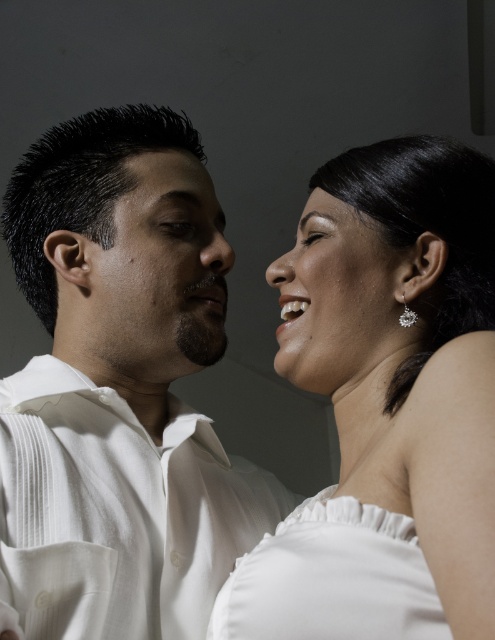
You are a photographer adjusting the lighting for a portrait. You notice the smooth skin face at center and the satin white earring at upper right. Which object should you focus your light on to highlight the face without overwhelming the earring?

The smooth skin face at center is above the satin white earring at upper right, so focusing the light on the smooth skin face at center will highlight it without overwhelming the earring below.

You are a photographer setting up for a formal portrait. You need to ensure that the white satin dress at upper right and the white pleated shirt at center are both visible in the frame. Based on their positions, which one is more to the right?

The white satin dress at upper right is positioned on the right side of the white pleated shirt at center, so the white satin dress at upper right is more to the right.